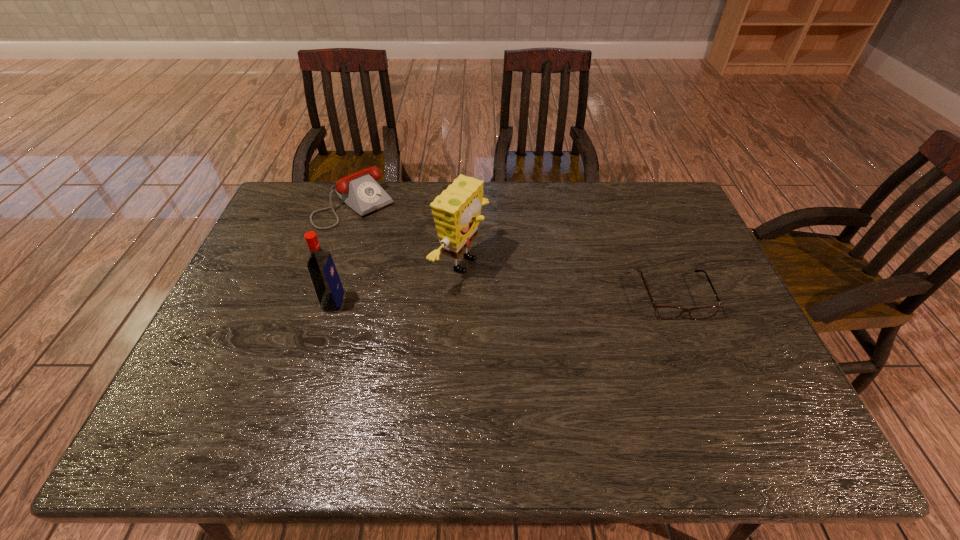
Locate an element on the screen. This screenshot has width=960, height=540. vacant space on the desktop that is between the vodka and the spectacles and is positioned on the front-facing side of the sponge is located at coordinates (552, 298).

The image size is (960, 540). I want to click on vacant spot on the desktop that is between the vodka and the shortest object and is positioned on the dial of the second shortest object, so click(x=455, y=300).